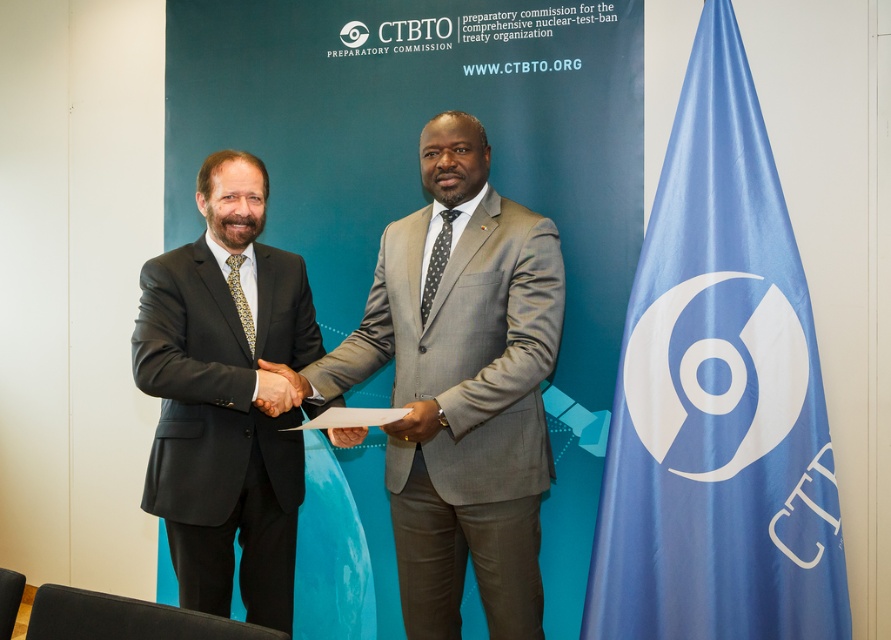
Question: Can you confirm if blue fabric flag at right is positioned to the right of smooth skin hand at center?

Choices:
 (A) yes
 (B) no

Answer: (A)

Question: Considering the relative positions of gray wool suit at center and black leather hand at center in the image provided, where is gray wool suit at center located with respect to black leather hand at center?

Choices:
 (A) right
 (B) left

Answer: (A)

Question: Which point is closer to the camera?

Choices:
 (A) (781, 513)
 (B) (528, 497)
 (C) (205, 388)

Answer: (C)

Question: Considering the real-world distances, which object is farthest from the blue fabric flag at right?

Choices:
 (A) black leather hand at center
 (B) matte black suit at left
 (C) smooth skin hand at center

Answer: (A)

Question: Which point is closer to the camera?

Choices:
 (A) pyautogui.click(x=274, y=403)
 (B) pyautogui.click(x=214, y=419)
 (C) pyautogui.click(x=331, y=432)
 (D) pyautogui.click(x=726, y=582)

Answer: (A)

Question: Considering the relative positions of blue fabric flag at right and smooth skin hand at center in the image provided, where is blue fabric flag at right located with respect to smooth skin hand at center?

Choices:
 (A) above
 (B) below

Answer: (A)